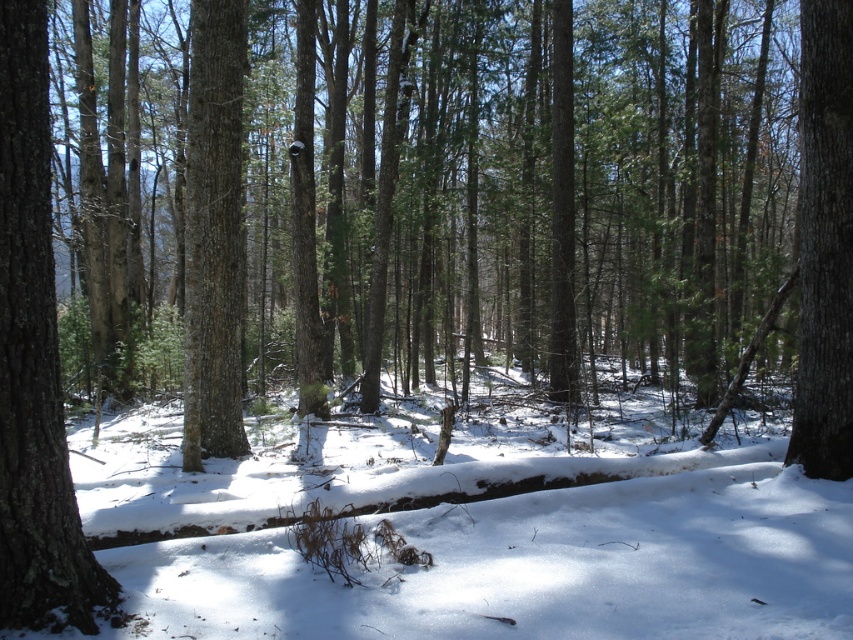
Question: Which object appears closest to the camera in this image?

Choices:
 (A) smooth brown tree trunk at right
 (B) white powdery snow at center
 (C) smooth bark tree at left

Answer: (C)

Question: Where is smooth bark tree at left located in relation to smooth brown tree trunk at center in the image?

Choices:
 (A) left
 (B) right

Answer: (B)

Question: Which point appears farthest from the camera in this image?

Choices:
 (A) (201, 83)
 (B) (35, 508)
 (C) (361, 632)

Answer: (A)

Question: Which of these objects is positioned farthest from the smooth bark tree at left?

Choices:
 (A) smooth brown tree trunk at right
 (B) smooth brown tree trunk at center

Answer: (B)

Question: Does white powdery snow at center have a larger size compared to smooth brown tree trunk at right?

Choices:
 (A) no
 (B) yes

Answer: (B)

Question: Is white powdery snow at center wider than smooth bark tree at left?

Choices:
 (A) no
 (B) yes

Answer: (B)